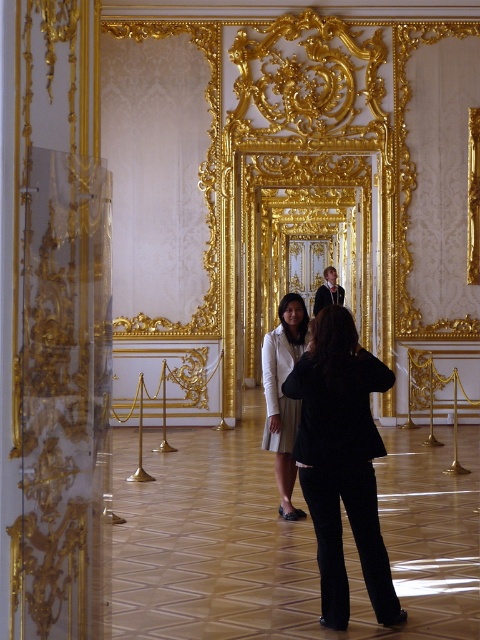
You are standing in the grand room and want to walk towards the point labeled as point (388, 376). Will you pass by point (296, 413) on your way there?

Yes, you will pass by point (296, 413) on your way to point (388, 376) because point (388, 376) is in front of point (296, 413).

You are a fashion designer who wants to display two garments in a museum exhibit. You have a black fabric coat at center and a light beige fabric dress at center. Given the space between them, can you place a 3 meter wide mannequin between them without overlapping?

The distance between the black fabric coat at center and the light beige fabric dress at center is 5.03 meters. Since the mannequin is 3 meters wide, there is enough space to place it between them without overlapping.

You are a guest at an event in this grand room and notice two outfits displayed at the center. Which one is to the left of the other? The light beige fabric dress at center and the smooth black suit at center are both displayed there. Could you tell me which one is positioned to the left?

The light beige fabric dress at center is positioned on the left side of the smooth black suit at center.